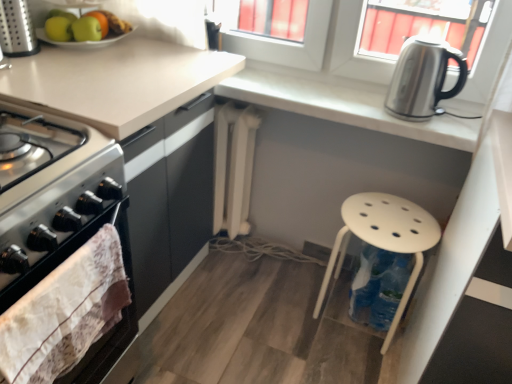
Find the location of `unoccupied region to the right of green matte apple at upper left, the second apple in the right-to-left sequence`. unoccupied region to the right of green matte apple at upper left, the second apple in the right-to-left sequence is located at coordinates (140, 48).